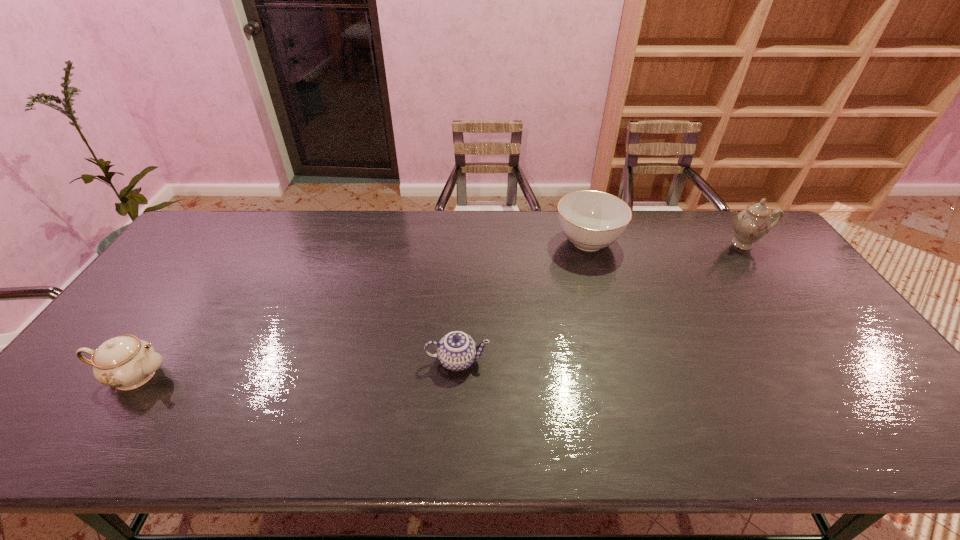
Locate which chinaware is the third closest to the third object from left to right. Please provide its 2D coordinates. Your answer should be formatted as a tuple, i.e. [(x, y)], where the tuple contains the x and y coordinates of a point satisfying the conditions above.

[(125, 362)]

The height and width of the screenshot is (540, 960). What are the coordinates of `free space that satisfies the following two spatial constraints: 1. on the spout of the tallest chinaware; 2. from the spout of the shortest object` in the screenshot? It's located at (826, 361).

The image size is (960, 540). I want to click on free space in the image that satisfies the following two spatial constraints: 1. on the spout of the tallest object; 2. at the spout of the leftmost object, so click(x=836, y=375).

The width and height of the screenshot is (960, 540). Identify the location of vacant space that satisfies the following two spatial constraints: 1. on the spout of the rightmost object; 2. from the spout of the third object from right to left. (826, 361).

Locate an element on the screen. The image size is (960, 540). free space that satisfies the following two spatial constraints: 1. on the spout of the tallest object; 2. at the spout of the leftmost object is located at coordinates (836, 375).